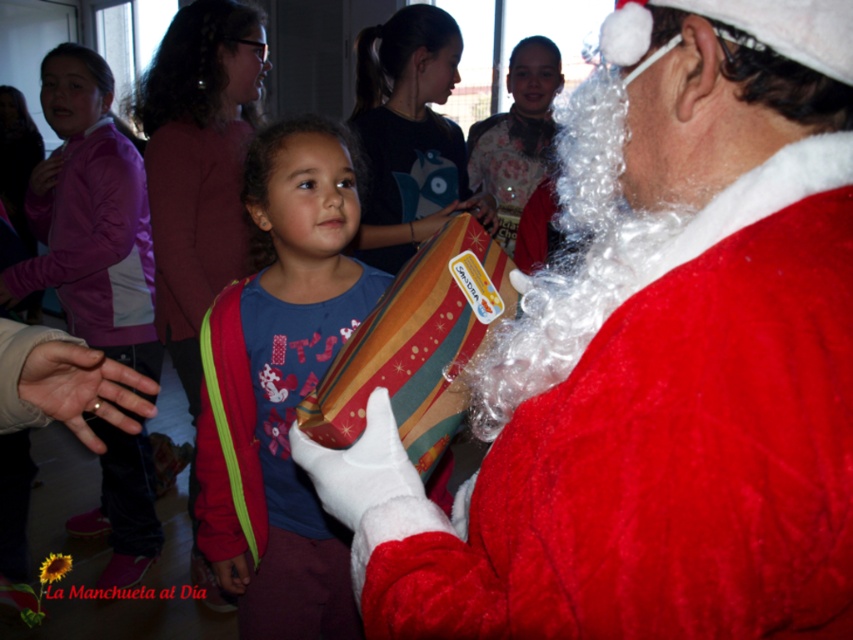
Question: Does matte blue shirt at center appear under purple fleece jacket at left?

Choices:
 (A) no
 (B) yes

Answer: (B)

Question: Is striped paper gift at center smaller than striped fabric gift at center?

Choices:
 (A) no
 (B) yes

Answer: (B)

Question: Which of the following is the farthest from the observer?

Choices:
 (A) (471, 228)
 (B) (238, 490)
 (C) (837, 312)

Answer: (B)

Question: Estimate the real-world distances between objects in this image. Which object is farther from the matte blue shirt at center?

Choices:
 (A) striped fabric gift at center
 (B) red velvet santa claus at center

Answer: (B)

Question: Does purple fleece jacket at left have a lesser width compared to striped fabric gift at center?

Choices:
 (A) no
 (B) yes

Answer: (A)

Question: Estimate the real-world distances between objects in this image. Which object is farther from the purple fleece jacket at left?

Choices:
 (A) matte blue shirt at center
 (B) striped fabric gift at center
 (C) striped paper gift at center
 (D) red velvet santa claus at center

Answer: (D)